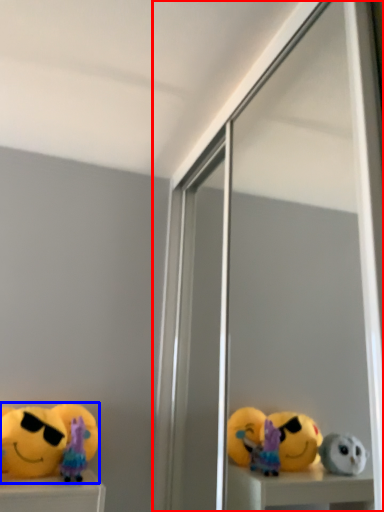
Question: Which object is further to the camera taking this photo, screen door (highlighted by a red box) or toy (highlighted by a blue box)?

Choices:
 (A) screen door
 (B) toy

Answer: (B)